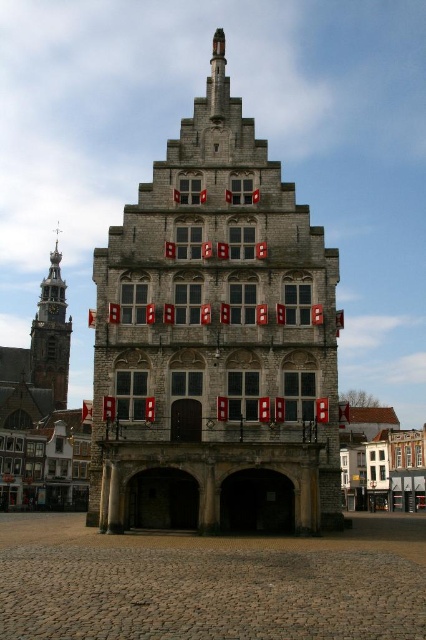
You are standing in front of a historic building and see the stone medieval building at center and the gold spire at left. Which object is positioned to the left?

The gold spire at left is positioned to the left of the stone medieval building at center.

What are the coordinates of the stone medieval building at center in the image?

The stone medieval building at center is located at coordinates point (215,342).

You are standing in front of the historic building and want to take a photo that includes both the stone medieval building at center and the gold spire at left. Which object should you position closer to the camera to ensure both are in focus?

Since the stone medieval building at center is closer to the viewer than the gold spire at left, you should position the camera closer to the stone medieval building at center to ensure both are in focus.